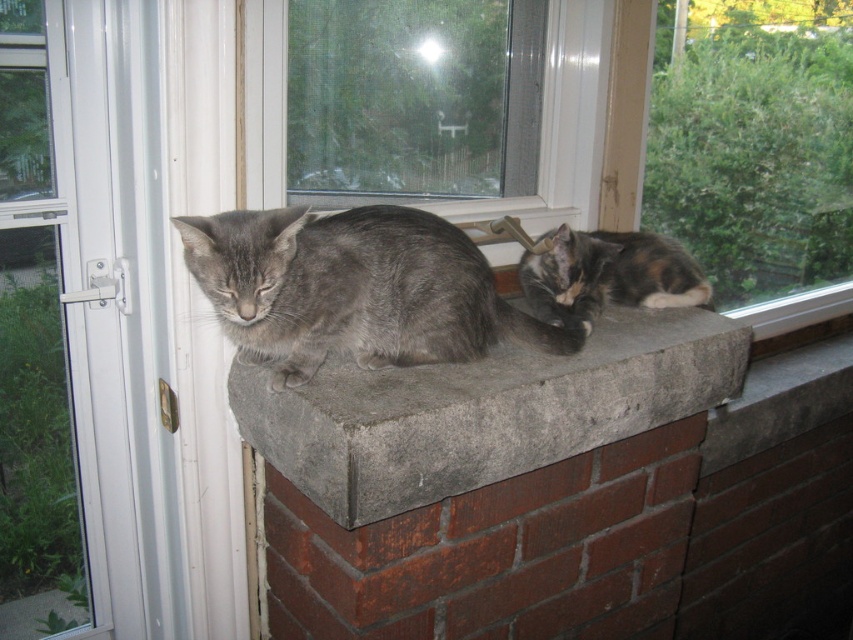
You are standing in front of the windowsill where the two cats are resting. You notice two points marked on the windowsill. Which point is closer to you, point (422, 500) or point (659, 192)?

Point (422, 500) is closer to the viewer than point (659, 192).